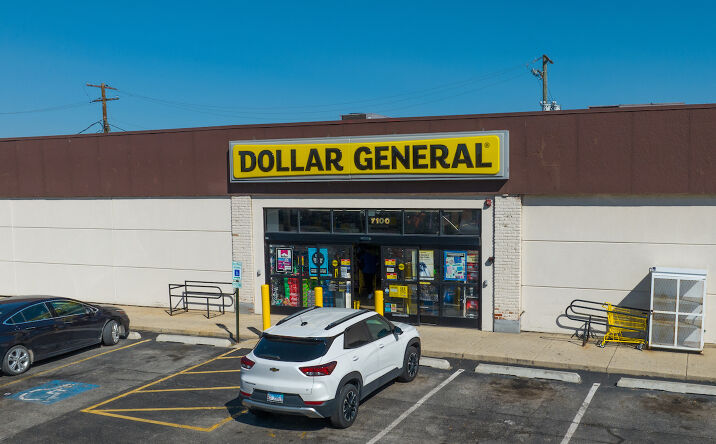
Locate an element on the screen. The height and width of the screenshot is (444, 716). doors is located at coordinates (321, 277), (435, 282).